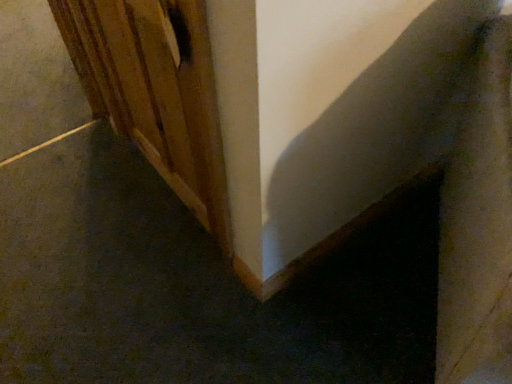
Question: From the image's perspective, would you say wooden door at left is shown under smooth gray concrete at lower left?

Choices:
 (A) yes
 (B) no

Answer: (A)

Question: Considering the relative sizes of wooden door at left and smooth gray concrete at lower left in the image provided, is wooden door at left smaller than smooth gray concrete at lower left?

Choices:
 (A) no
 (B) yes

Answer: (B)

Question: Is wooden door at left turned away from smooth gray concrete at lower left?

Choices:
 (A) yes
 (B) no

Answer: (B)

Question: From the image's perspective, is wooden door at left on smooth gray concrete at lower left?

Choices:
 (A) yes
 (B) no

Answer: (B)

Question: Is wooden door at left at the left side of smooth gray concrete at lower left?

Choices:
 (A) yes
 (B) no

Answer: (B)

Question: Is smooth gray concrete at lower left inside wooden door at left?

Choices:
 (A) yes
 (B) no

Answer: (B)

Question: Is wooden door at left located within smooth gray concrete at lower left?

Choices:
 (A) no
 (B) yes

Answer: (A)

Question: Would you say smooth gray concrete at lower left is a long distance from wooden door at left?

Choices:
 (A) no
 (B) yes

Answer: (A)

Question: Is smooth gray concrete at lower left thinner than wooden door at left?

Choices:
 (A) yes
 (B) no

Answer: (B)

Question: From a real-world perspective, is smooth gray concrete at lower left on wooden door at left?

Choices:
 (A) yes
 (B) no

Answer: (B)

Question: Is smooth gray concrete at lower left beside wooden door at left?

Choices:
 (A) yes
 (B) no

Answer: (B)

Question: Is smooth gray concrete at lower left oriented towards wooden door at left?

Choices:
 (A) yes
 (B) no

Answer: (B)

Question: Visually, is wooden door at left positioned to the left or to the right of smooth gray concrete at lower left?

Choices:
 (A) right
 (B) left

Answer: (A)